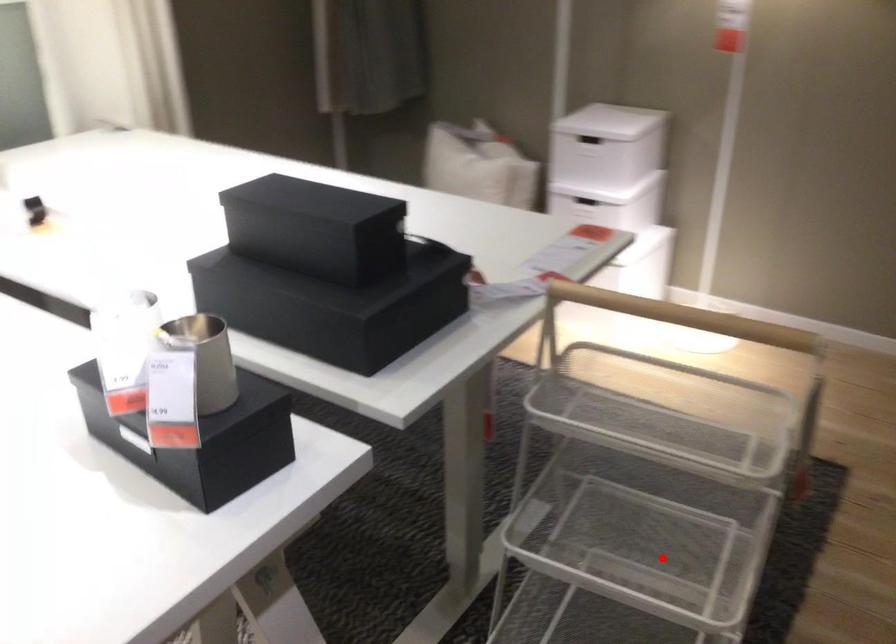
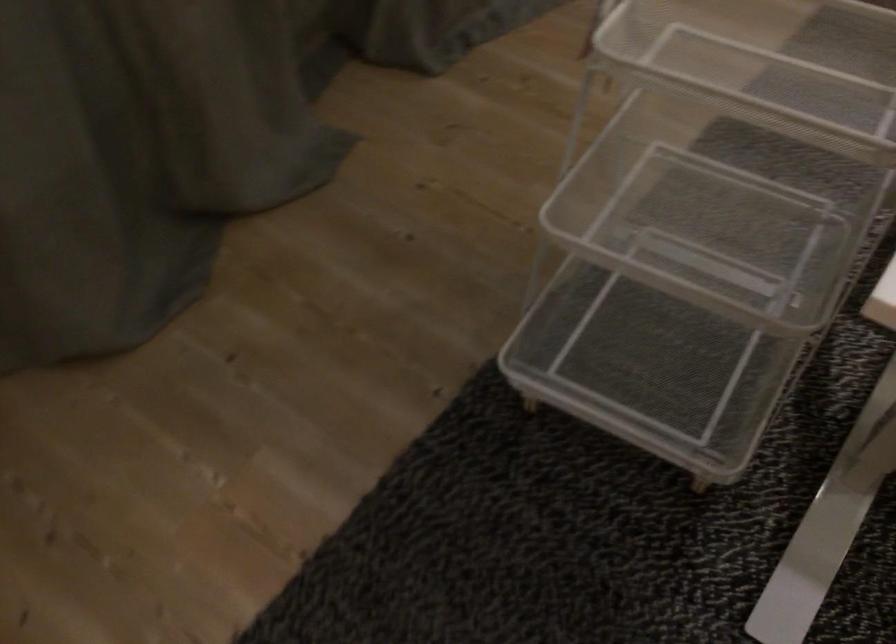
Locate, in the second image, the point that corresponds to the highlighted location in the first image.

(698, 209)